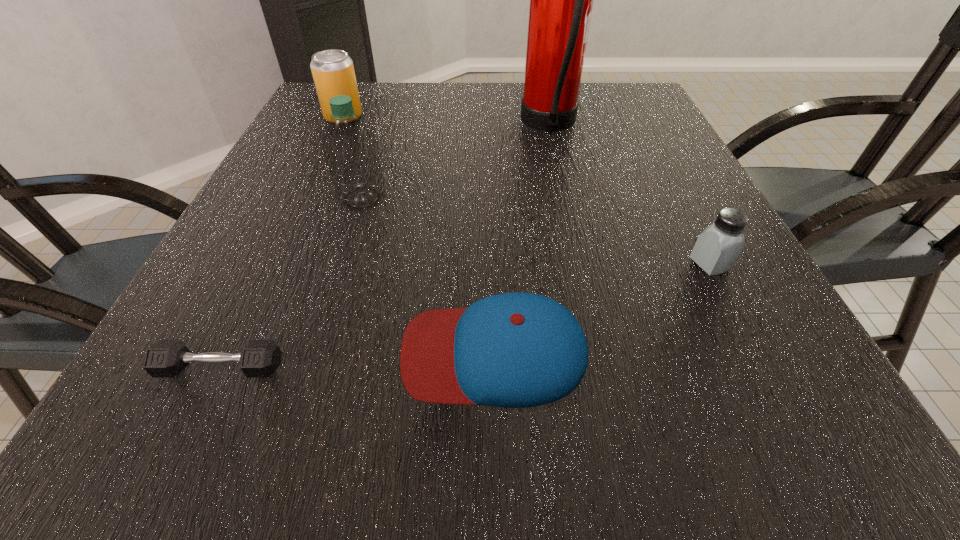
Identify the location of dumbbell that is at the left edge. This screenshot has height=540, width=960. (166, 358).

You are a GUI agent. You are given a task and a screenshot of the screen. Output one action in this format:
    pyautogui.click(x=<x>, y=<y>)
    Task: Click on the object that is positioned at the right edge
    This screenshot has height=540, width=960.
    Given the screenshot: What is the action you would take?
    [x=717, y=248]

This screenshot has width=960, height=540. Find the location of `object that is at the far left corner`. object that is at the far left corner is located at coordinates point(333,72).

The width and height of the screenshot is (960, 540). I want to click on free space at the far edge of the desktop, so click(587, 112).

Locate an element on the screen. The width and height of the screenshot is (960, 540). free space at the near edge of the desktop is located at coordinates (401, 443).

Identify the location of vacant space at the left edge of the desktop. (252, 294).

This screenshot has width=960, height=540. In the image, there is a desktop. In order to click on vacant space at the right edge in this screenshot , I will do `click(695, 332)`.

This screenshot has height=540, width=960. I want to click on free location at the far left corner, so click(x=300, y=115).

The image size is (960, 540). Find the location of `blank space at the far right corner of the desktop`. blank space at the far right corner of the desktop is located at coordinates (630, 93).

Find the location of `vacant area that lies between the fourth shortest object and the saltshaker`. vacant area that lies between the fourth shortest object and the saltshaker is located at coordinates (527, 190).